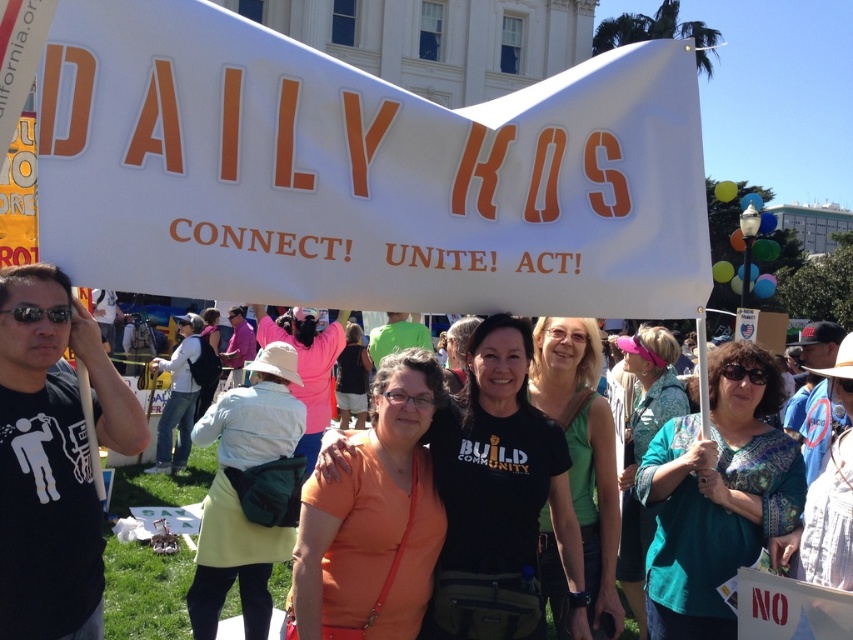
You are a photographer at the protest and want to capture a clear photo of the orange matte shirt at center and the green matte tank top at center. Which one will appear larger in the photo?

The orange matte shirt at center will appear larger in the photo because it is closer to the viewer than the green matte tank top at center.

From the picture: You are a photographer at the protest scene. You want to take a photo focusing on the teal printed blouse at center and the green matte tank top at center. Which clothing item is positioned lower on the person wearing them?

The teal printed blouse at center is positioned lower because it is below the green matte tank top at center.